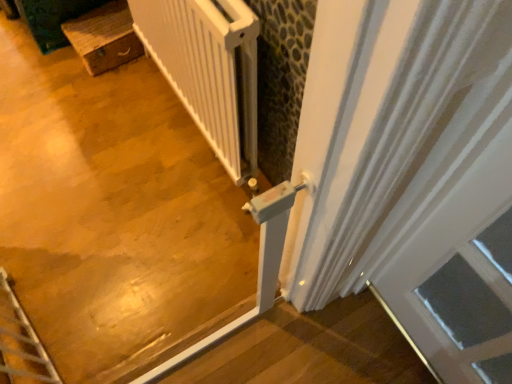
Image resolution: width=512 pixels, height=384 pixels. Describe the element at coordinates (208, 69) in the screenshot. I see `white matte radiator at center` at that location.

What are the coordinates of `white matte radiator at center` in the screenshot? It's located at (208, 69).

You are a GUI agent. You are given a task and a screenshot of the screen. Output one action in this format:
    pyautogui.click(x=<x>, y=<y>)
    Task: Click on the white matte radiator at center
    This screenshot has width=512, height=384.
    Given the screenshot: What is the action you would take?
    pyautogui.click(x=208, y=69)